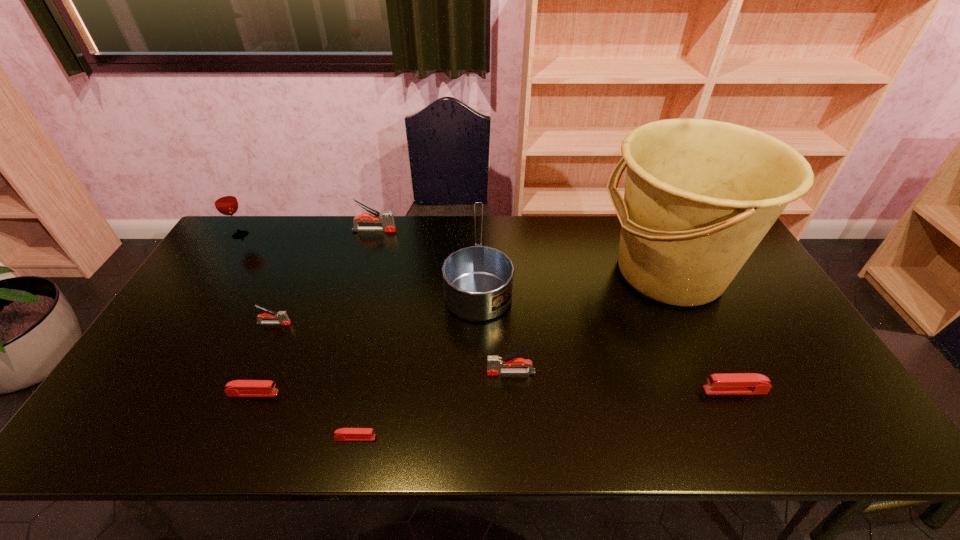
This screenshot has width=960, height=540. I want to click on bucket, so click(x=700, y=195).

The image size is (960, 540). In order to click on the leftmost object in this screenshot , I will do `click(226, 203)`.

Where is `glass`? glass is located at coordinates (226, 203).

This screenshot has width=960, height=540. In order to click on the second gray stapler from right to left in this screenshot , I will do `click(386, 218)`.

Find the location of a particular element. The image size is (960, 540). the biggest gray stapler is located at coordinates (386, 218).

Image resolution: width=960 pixels, height=540 pixels. In order to click on saucepan in this screenshot , I will do `click(478, 280)`.

What are the coordinates of `the second biggest gray stapler` in the screenshot? It's located at (495, 366).

You are a GUI agent. You are given a task and a screenshot of the screen. Output one action in this format:
    pyautogui.click(x=<x>, y=<y>)
    Task: Click on the nearest gray stapler
    The height and width of the screenshot is (540, 960).
    Given the screenshot: What is the action you would take?
    pyautogui.click(x=495, y=366)

Where is `the second farthest stapler`? the second farthest stapler is located at coordinates (282, 316).

You are a GUI agent. You are given a task and a screenshot of the screen. Output one action in this format:
    pyautogui.click(x=<x>, y=<y>)
    Task: Click on the smallest gray stapler
    This screenshot has height=540, width=960.
    Given the screenshot: What is the action you would take?
    click(282, 316)